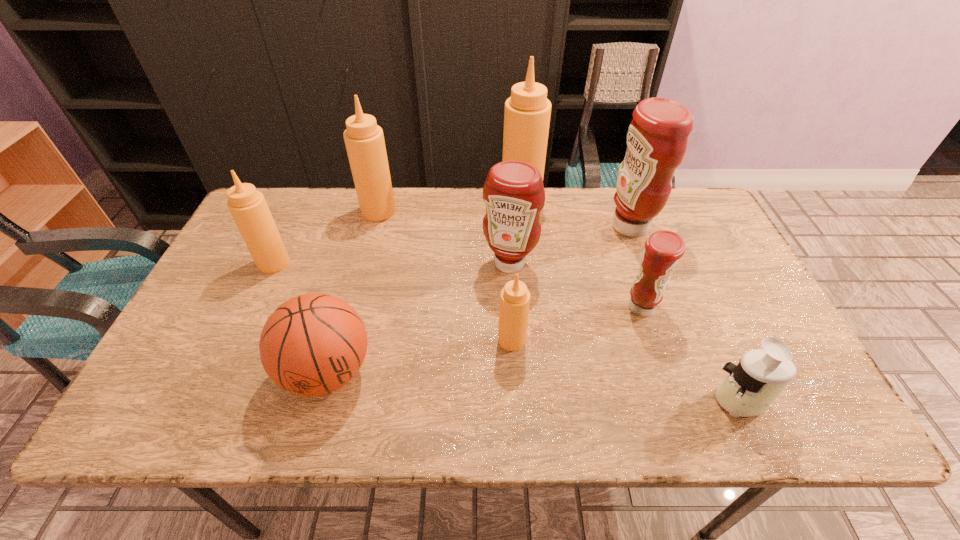
Where is `vacant space at the near edge of the desktop`? This screenshot has width=960, height=540. vacant space at the near edge of the desktop is located at coordinates (640, 404).

Find the location of `blank space at the left edge`. blank space at the left edge is located at coordinates (175, 371).

At what (x,y) coordinates should I click in order to perform the action: click on free spot at the right edge of the desktop. Please return your answer as a coordinate pair (x, y). The height and width of the screenshot is (540, 960). Looking at the image, I should click on (777, 333).

In the image, there is a desktop. What are the coordinates of `blank space at the far left corner` in the screenshot? It's located at (274, 187).

Locate an element on the screen. The image size is (960, 540). blank space at the far right corner of the desktop is located at coordinates click(x=684, y=204).

I want to click on free area in between the basketball and the leftmost red condiment, so click(419, 318).

The height and width of the screenshot is (540, 960). In order to click on free spot between the tallest condiment and the second nearest tan condiment in this screenshot , I will do `click(397, 231)`.

Image resolution: width=960 pixels, height=540 pixels. In order to click on vacant space that's between the farthest red condiment and the leftmost red condiment in this screenshot , I will do `click(569, 245)`.

Image resolution: width=960 pixels, height=540 pixels. Find the location of `free spot between the second smallest tan condiment and the biggest tan condiment`. free spot between the second smallest tan condiment and the biggest tan condiment is located at coordinates (397, 231).

Locate an element on the screen. Image resolution: width=960 pixels, height=540 pixels. free spot between the smallest red condiment and the juicer is located at coordinates (691, 354).